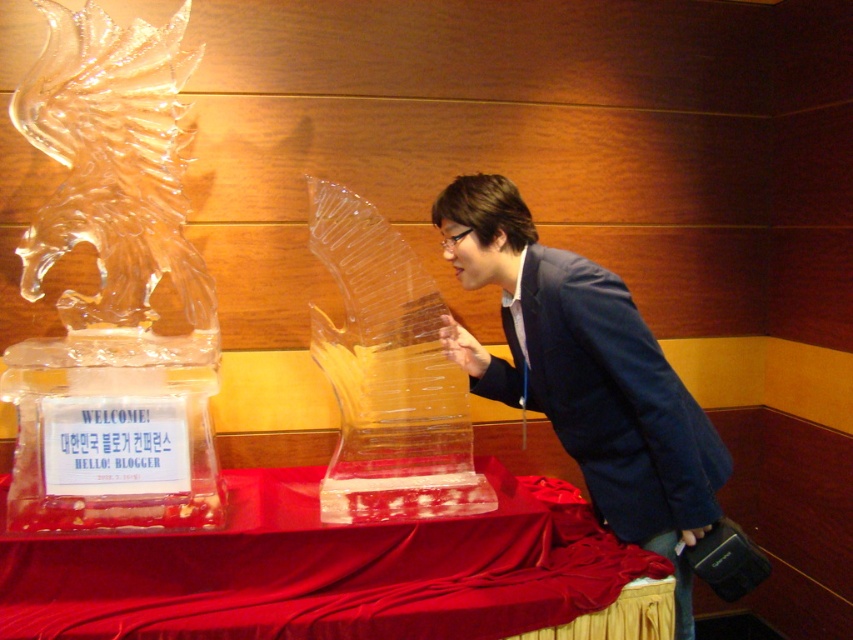
You are a photographer planning to capture the height difference between the clear ice sculpture at left and the transparent ice sculpture at center. Which sculpture should you focus on to emphasize its height in the photo?

The clear ice sculpture at left is much taller than the transparent ice sculpture at center, so focusing on the clear ice sculpture at left will better emphasize its height in the photo.

You are a photographer setting up a shoot in this room. You want to place a 1.2 meter wide backdrop behind the clear ice sculpture at left and the smooth red fabric at center. Based on their widths, which object requires a wider backdrop?

The smooth red fabric at center requires a wider backdrop because the clear ice sculpture at left is narrower than the smooth red fabric at center according to the description.

You are a photographer trying to capture the clear ice sculpture at left and the blue fabric jacket at center in a single shot. Which object should you focus on first if you want to ensure both are in frame without moving the camera?

The clear ice sculpture at left is smaller than the blue fabric jacket at center, so you should focus on the blue fabric jacket at center first to ensure it fits within the frame while still capturing the smaller sculpture.